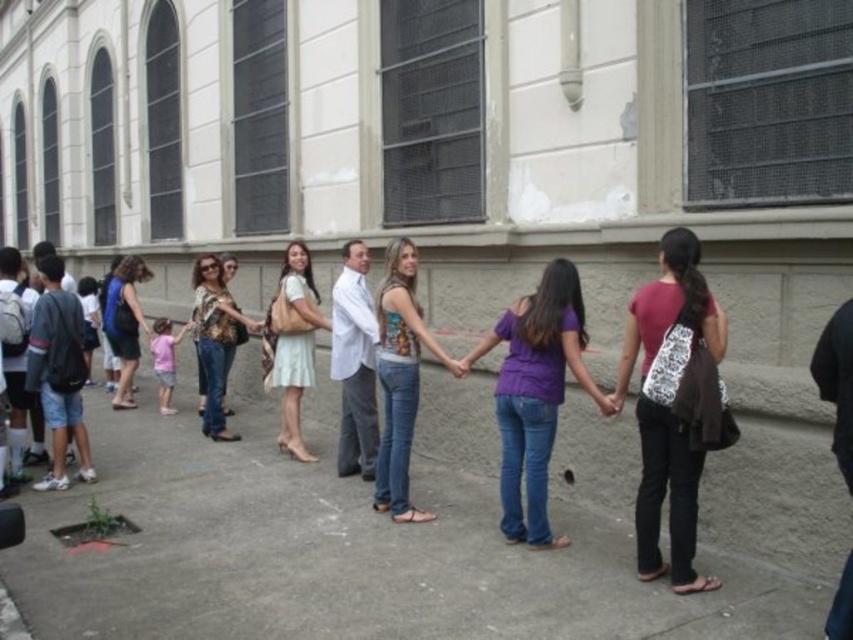
From the picture: You are organizing a photoshoot and need to arrange two outfits for a size comparison. The outfits are the printed fabric blouse at center and the pink fabric shirt at lower left. Based on their sizes, which outfit should be placed on the larger mannequin?

The pink fabric shirt at lower left should be placed on the larger mannequin because its width is greater than the printed fabric blouse at center.

You are a fashion designer observing the scene. You need to determine if the distance between the printed fabric blouse at center and the pink fabric shirt at lower left is sufficient to allow a 1 meter wide decorative cloth to be placed between them. Can you confirm this?

The printed fabric blouse at center is 90.30 centimeters away from the pink fabric shirt at lower left. Since 90.30 centimeters is less than 1 meter, the decorative cloth cannot be placed between them.

You are a photographer trying to capture a clear shot of the printed fabric tank top at center and the pink fabric shirt at lower left. Since you want to focus on the smaller one, which clothing item should you zoom in on?

The printed fabric tank top at center has a smaller size compared to the pink fabric shirt at lower left, so you should zoom in on the printed fabric tank top at center.